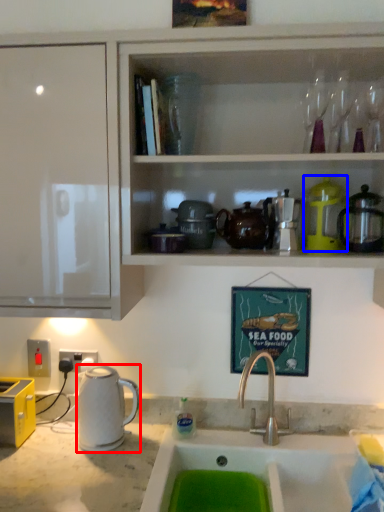
Question: Which object appears farthest to the camera in this image, kitchen appliance (highlighted by a red box) or appliance (highlighted by a blue box)?

Choices:
 (A) kitchen appliance
 (B) appliance

Answer: (A)